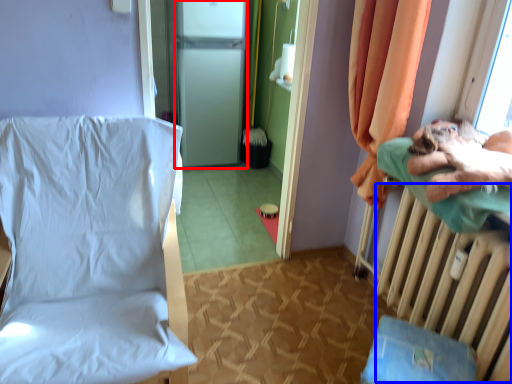
Question: Which object is closer to the camera taking this photo, screen door (highlighted by a red box) or radiator (highlighted by a blue box)?

Choices:
 (A) screen door
 (B) radiator

Answer: (B)